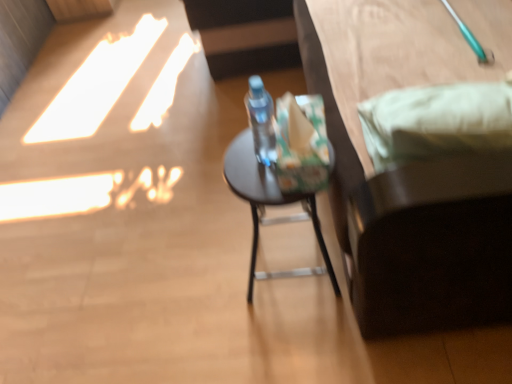
Question: Does matte black stool at center lie in front of transparent plastic bottle at center?

Choices:
 (A) no
 (B) yes

Answer: (A)

Question: Considering the relative sizes of matte black stool at center and transparent plastic bottle at center in the image provided, is matte black stool at center wider than transparent plastic bottle at center?

Choices:
 (A) no
 (B) yes

Answer: (B)

Question: Can you confirm if matte black stool at center is positioned to the right of transparent plastic bottle at center?

Choices:
 (A) no
 (B) yes

Answer: (B)

Question: Is matte black stool at center completely or partially outside of transparent plastic bottle at center?

Choices:
 (A) no
 (B) yes

Answer: (B)

Question: Does matte black stool at center have a greater height compared to transparent plastic bottle at center?

Choices:
 (A) yes
 (B) no

Answer: (A)

Question: From a real-world perspective, is transparent plastic bottle at center above or below matte black stool at center?

Choices:
 (A) above
 (B) below

Answer: (A)

Question: Looking at their shapes, would you say transparent plastic bottle at center is wider or thinner than matte black stool at center?

Choices:
 (A) thin
 (B) wide

Answer: (A)

Question: Considering the positions of transparent plastic bottle at center and matte black stool at center in the image, is transparent plastic bottle at center bigger or smaller than matte black stool at center?

Choices:
 (A) big
 (B) small

Answer: (B)

Question: Would you say transparent plastic bottle at center is to the left or to the right of matte black stool at center in the picture?

Choices:
 (A) right
 (B) left

Answer: (B)

Question: In the image, is dark brown wooden bed at right on the left side or the right side of transparent plastic bottle at center?

Choices:
 (A) left
 (B) right

Answer: (B)

Question: Is dark brown wooden bed at right spatially inside transparent plastic bottle at center, or outside of it?

Choices:
 (A) inside
 (B) outside

Answer: (B)

Question: Is dark brown wooden bed at right wider or thinner than transparent plastic bottle at center?

Choices:
 (A) thin
 (B) wide

Answer: (B)

Question: From the image's perspective, is dark brown wooden bed at right above or below transparent plastic bottle at center?

Choices:
 (A) below
 (B) above

Answer: (B)

Question: In the image, is matte black stool at center on the left side or the right side of transparent plastic bottle at center?

Choices:
 (A) left
 (B) right

Answer: (B)

Question: From a real-world perspective, is matte black stool at center physically located above or below transparent plastic bottle at center?

Choices:
 (A) below
 (B) above

Answer: (A)